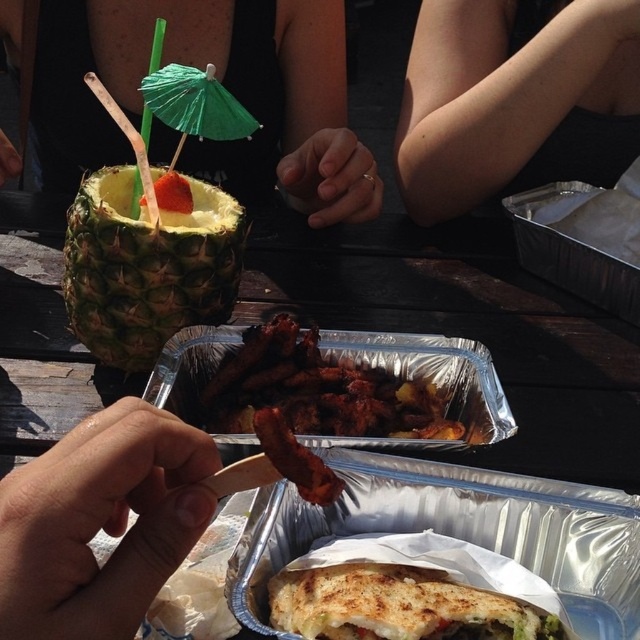
Between matte black pineapple at upper left and smoked crispy bacon at center, which one is positioned higher?

Positioned higher is matte black pineapple at upper left.

Can you confirm if matte black pineapple at upper left is taller than smoked crispy bacon at center?

Indeed, matte black pineapple at upper left has a greater height compared to smoked crispy bacon at center.

What are the coordinates of `matte black pineapple at upper left` in the screenshot? It's located at (224, 83).

Locate an element on the screen. matte black pineapple at upper left is located at coordinates (224, 83).

Is point (307, 410) less distant than point (500, 624)?

No, (307, 410) is further to viewer.

Who is positioned more to the right, slightly charred wood at center or golden crispy sandwich at center?

From the viewer's perspective, golden crispy sandwich at center appears more on the right side.

What do you see at coordinates (317, 390) in the screenshot? I see `slightly charred wood at center` at bounding box center [317, 390].

I want to click on slightly charred wood at center, so [x=317, y=390].

Does point (260, 138) come in front of point (109, 531)?

That is False.

Is point (113, 134) in front of point (177, 432)?

No, (113, 134) is behind (177, 432).

Locate an element on the screen. matte black pineapple at upper left is located at coordinates (224, 83).